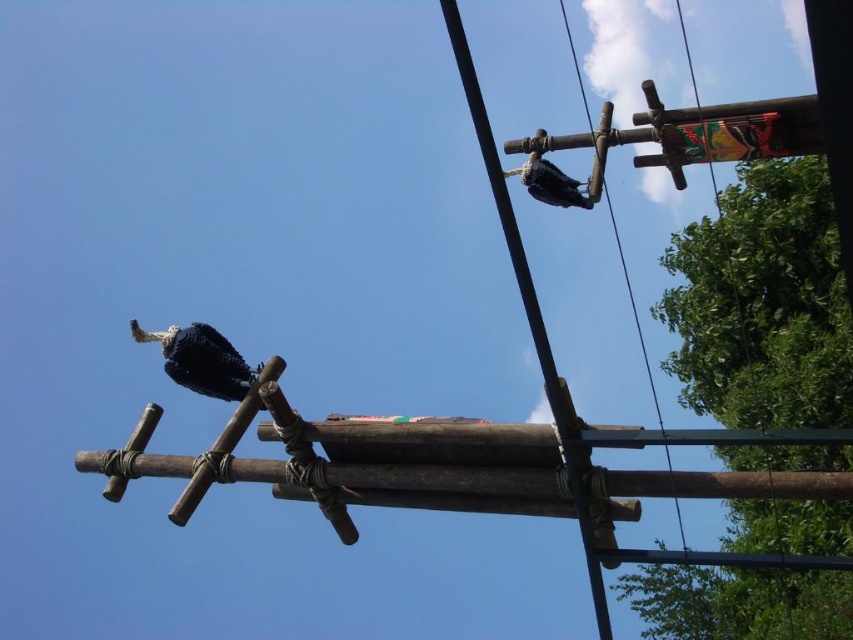
Question: Which object is closer to the camera taking this photo?

Choices:
 (A) blue glossy woodpecker at upper center
 (B) blue speckled feathers at left

Answer: (B)

Question: Does blue speckled feathers at left have a smaller size compared to blue glossy woodpecker at upper center?

Choices:
 (A) yes
 (B) no

Answer: (B)

Question: Can you confirm if blue speckled feathers at left is wider than blue glossy woodpecker at upper center?

Choices:
 (A) yes
 (B) no

Answer: (A)

Question: Is blue speckled feathers at left positioned behind blue glossy woodpecker at upper center?

Choices:
 (A) yes
 (B) no

Answer: (B)